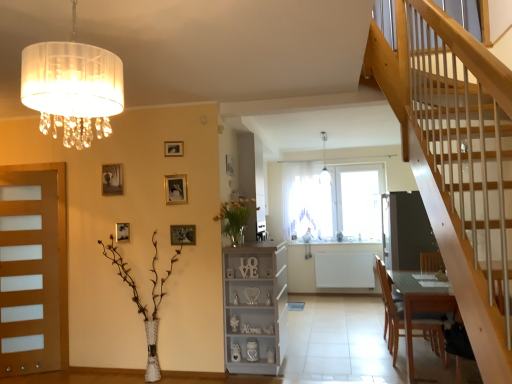
What is the approximate width of translucent glass vase at left, acting as the second floral arrangement starting from the right?

26.78 inches.

This screenshot has height=384, width=512. Describe the element at coordinates (140, 302) in the screenshot. I see `translucent glass vase at left, acting as the second floral arrangement starting from the right` at that location.

The height and width of the screenshot is (384, 512). Find the location of `matte gold picture frame at upper left, the sixth picture frame viewed from the right`. matte gold picture frame at upper left, the sixth picture frame viewed from the right is located at coordinates (112, 179).

At what (x,y) coordinates should I click in order to perform the action: click on wooden door at left. Please return your answer as a coordinate pair (x, y). This screenshot has width=512, height=384. Looking at the image, I should click on (33, 270).

Which object is closer to the camera taking this photo, translucent fabric lampshade at upper left or white sheer curtain at center?

translucent fabric lampshade at upper left.

Which is further, [112,57] or [317,209]?

Point [317,209]

Who is shorter, translucent fabric lampshade at upper left or white sheer curtain at center?

translucent fabric lampshade at upper left.

Are translucent fabric lampshade at upper left and white sheer curtain at center located far from each other?

Yes, translucent fabric lampshade at upper left is far from white sheer curtain at center.

From the image's perspective, relative to wooden door at left, is white glass pendant light at upper center above or below?

Based on their image positions, white glass pendant light at upper center is located above wooden door at left.

Is the surface of white glass pendant light at upper center in direct contact with wooden door at left?

white glass pendant light at upper center is not next to wooden door at left, and they're not touching.

Is white glass pendant light at upper center located outside wooden door at left?

That's correct, white glass pendant light at upper center is outside of wooden door at left.

Which object is positioned more to the left, white glass pendant light at upper center or wooden door at left?

Positioned to the left is wooden door at left.

Between point (232, 161) and point (400, 254), which one is positioned behind?

The point (400, 254) is behind.

Is wooden picture frame at upper center, the 6th picture frame positioned from the left, facing away from dark gray matte screen door at center?

No, wooden picture frame at upper center, the 6th picture frame positioned from the left, is not facing away from dark gray matte screen door at center.

In the scene shown: Which is more to the right, wooden picture frame at upper center, the 6th picture frame positioned from the front, or dark gray matte screen door at center?

From the viewer's perspective, dark gray matte screen door at center appears more on the right side.

What's the angular difference between wooden picture frame at upper center, the 6th picture frame positioned from the left, and dark gray matte screen door at center's facing directions?

The angular difference between wooden picture frame at upper center, the 6th picture frame positioned from the left, and dark gray matte screen door at center is 179 degrees.

Considering the relative sizes of dark gray matte screen door at center and brown wooden chair at lower right in the image provided, is dark gray matte screen door at center taller than brown wooden chair at lower right?

Correct, dark gray matte screen door at center is much taller as brown wooden chair at lower right.

Could you tell me if dark gray matte screen door at center is turned towards brown wooden chair at lower right?

No, dark gray matte screen door at center does not turn towards brown wooden chair at lower right.

From a real-world perspective, is dark gray matte screen door at center on brown wooden chair at lower right?

Indeed, from a real-world perspective, dark gray matte screen door at center stands above brown wooden chair at lower right.

This screenshot has height=384, width=512. In order to click on chair below the dark gray matte screen door at center (from a real-world perspective) in this screenshot , I will do `click(390, 310)`.

In terms of size, does white glass pendant light at upper center appear bigger or smaller than translucent glass vase at left, acting as the second floral arrangement starting from the right?

Clearly, white glass pendant light at upper center is smaller in size than translucent glass vase at left, acting as the second floral arrangement starting from the right.

Considering the positions of points (329, 179) and (142, 310), is point (329, 179) farther from camera compared to point (142, 310)?

Yes, point (329, 179) is farther from viewer.

Is white glass pendant light at upper center at the right side of translucent glass vase at left, the 1th floral arrangement in the left-to-right sequence?

Correct, you'll find white glass pendant light at upper center to the right of translucent glass vase at left, the 1th floral arrangement in the left-to-right sequence.

Based on the photo, from the image's perspective, between white glass pendant light at upper center and translucent glass vase at left, the second floral arrangement in the top-to-bottom sequence, which one is located above?

white glass pendant light at upper center, from the image's perspective.

I want to click on the 1st picture frame above the metallic gold picture frame at upper center, the second picture frame from the right (from the image's perspective), so click(x=122, y=232).

Is wooden picture frame at upper left, which is the 4th picture frame in front-to-back order, facing towards metallic gold picture frame at upper center, the second picture frame from the right?

No, wooden picture frame at upper left, which is the 4th picture frame in front-to-back order, is not facing towards metallic gold picture frame at upper center, the second picture frame from the right.

From the picture: Considering the sizes of objects wooden picture frame at upper left, which is the 4th picture frame in front-to-back order, and metallic gold picture frame at upper center, the fifth picture frame positioned from the left, in the image provided, who is shorter, wooden picture frame at upper left, which is the 4th picture frame in front-to-back order, or metallic gold picture frame at upper center, the fifth picture frame positioned from the left,?

With less height is wooden picture frame at upper left, which is the 4th picture frame in front-to-back order.

Considering the positions of points (122, 231) and (184, 241), is point (122, 231) farther from camera compared to point (184, 241)?

Yes.

In the image, is wooden door at left positioned in front of or behind brown wooden chair at lower right?

Clearly, wooden door at left is behind brown wooden chair at lower right.

Considering the relative sizes of wooden door at left and brown wooden chair at lower right in the image provided, is wooden door at left taller than brown wooden chair at lower right?

Yes.

From the image's perspective, is wooden door at left beneath brown wooden chair at lower right?

Incorrect, from the image's perspective, wooden door at left is higher than brown wooden chair at lower right.

Which is behind, point (36, 260) or point (389, 321)?

Positioned behind is point (36, 260).

This screenshot has height=384, width=512. I want to click on lamp above the white sheer curtain at center (from a real-world perspective), so click(x=72, y=88).

Locate an element on the screen. The image size is (512, 384). door beneath the white glass pendant light at upper center (from a real-world perspective) is located at coordinates (33, 270).

When comparing their distances from light gray wood cabinet at center, does wooden picture frame at upper center, the 6th picture frame positioned from the left, or white glass pendant light at upper center seem closer?

wooden picture frame at upper center, the 6th picture frame positioned from the left, lies closer to light gray wood cabinet at center than the other object.

Considering their positions, is brown wooden chair at lower right positioned closer to translucent fabric lampshade at upper left than metallic gold picture frame at upper center, positioned as the first picture frame in front-to-back order?

metallic gold picture frame at upper center, positioned as the first picture frame in front-to-back order, is closer to translucent fabric lampshade at upper left.

Considering their positions, is white sheer curtain at center positioned further to matte gold picture frame at upper left, the second picture frame positioned from the back, than yellow matte vase at center, which is the 2th floral arrangement from left to right?

Among the two, white sheer curtain at center is located further to matte gold picture frame at upper left, the second picture frame positioned from the back.

Based on their spatial positions, is dark gray matte screen door at center or wooden picture frame at upper center, placed as the fourth picture frame when sorted from right to left, closer to wooden picture frame at upper left, arranged as the second picture frame when viewed from the left?

The object closer to wooden picture frame at upper left, arranged as the second picture frame when viewed from the left, is wooden picture frame at upper center, placed as the fourth picture frame when sorted from right to left.

Considering their positions, is brown wooden chair at lower right positioned further to white sheer curtain at center than wooden picture frame at upper center, which is the 3th picture frame in left-to-right order?

wooden picture frame at upper center, which is the 3th picture frame in left-to-right order, is positioned further to the anchor white sheer curtain at center.

Looking at the image, which one is located further to translucent glass vase at left, arranged as the 1th floral arrangement when ordered from the bottom, dark gray matte screen door at center or matte gold picture frame at upper left, arranged as the 5th picture frame when viewed from the front?

Based on the image, dark gray matte screen door at center appears to be further to translucent glass vase at left, arranged as the 1th floral arrangement when ordered from the bottom.

Which object lies further to the anchor point translucent glass vase at left, the 1th floral arrangement in the left-to-right sequence, metallic gold picture frame at upper center, the fifth picture frame positioned from the left, or wooden picture frame at upper center, which is the 3th picture frame in left-to-right order?

wooden picture frame at upper center, which is the 3th picture frame in left-to-right order, lies further to translucent glass vase at left, the 1th floral arrangement in the left-to-right sequence, than the other object.

Estimate the real-world distances between objects in this image. Which object is further from yellow matte vase at center, which is counted as the second floral arrangement, starting from the bottom, light gray wood cabinet at center or gold metallic picture frame at upper center, which appears as the 4th picture frame when viewed from the left?

light gray wood cabinet at center is positioned further to the anchor yellow matte vase at center, which is counted as the second floral arrangement, starting from the bottom.

Where is `door between translucent fabric lampshade at upper left and matte gold picture frame at upper left, the second picture frame positioned from the back, along the z-axis`? The width and height of the screenshot is (512, 384). door between translucent fabric lampshade at upper left and matte gold picture frame at upper left, the second picture frame positioned from the back, along the z-axis is located at coordinates (33, 270).

Find the location of a particular element. Image resolution: width=512 pixels, height=384 pixels. cabinetry between matte gold picture frame at upper left, the sixth picture frame viewed from the right, and dark gray matte screen door at center is located at coordinates (255, 307).

Locate an element on the screen. Image resolution: width=512 pixels, height=384 pixels. floral arrangement located between translucent glass vase at left, the second floral arrangement in the top-to-bottom sequence, and brown wooden chair at lower right in the left-right direction is located at coordinates (234, 217).

Locate an element on the screen. The width and height of the screenshot is (512, 384). screen door located between wooden picture frame at upper center, placed as the fourth picture frame when sorted from right to left, and white sheer curtain at center in the depth direction is located at coordinates (406, 231).